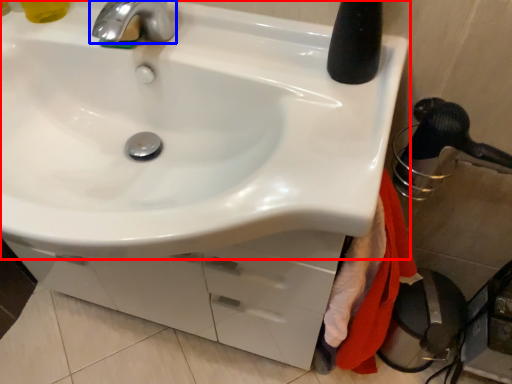
Question: Which point is further to the camera, sink (highlighted by a red box) or tap (highlighted by a blue box)?

Choices:
 (A) sink
 (B) tap

Answer: (B)